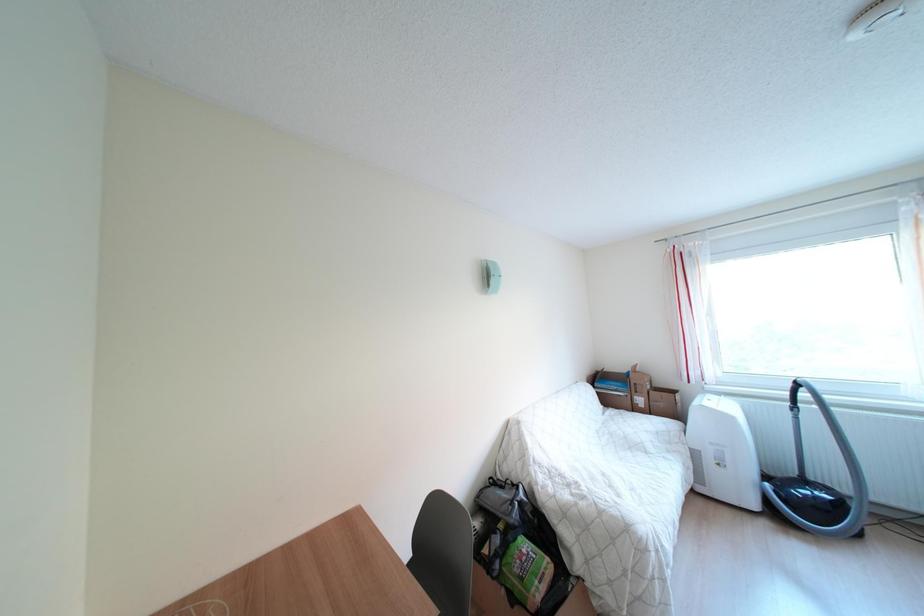
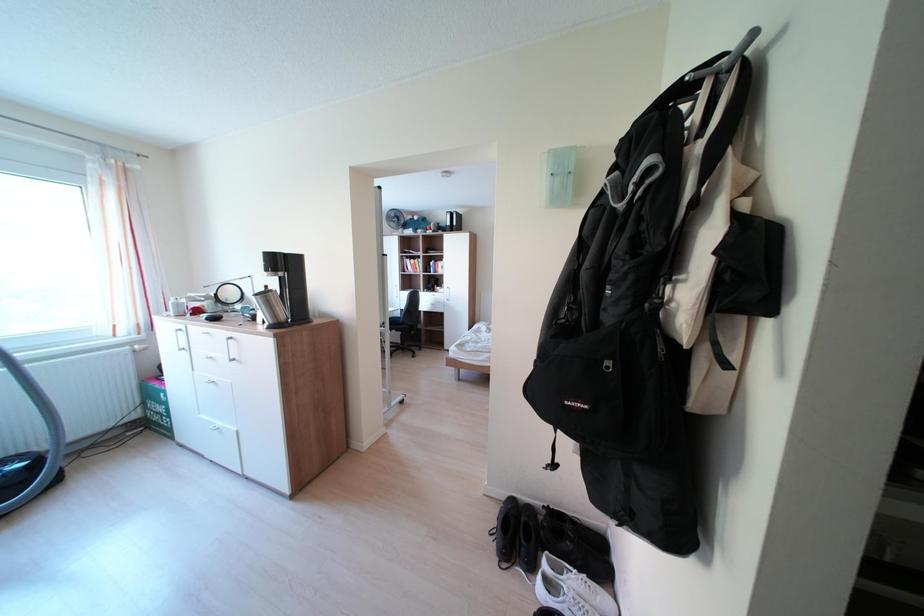
Question: The camera is either moving clockwise (left) or counter-clockwise (right) around the object. The first image is from the beginning of the video and the second image is from the end. Is the camera moving left or right when shooting the video?

Choices:
 (A) Left
 (B) Right

Answer: (A)